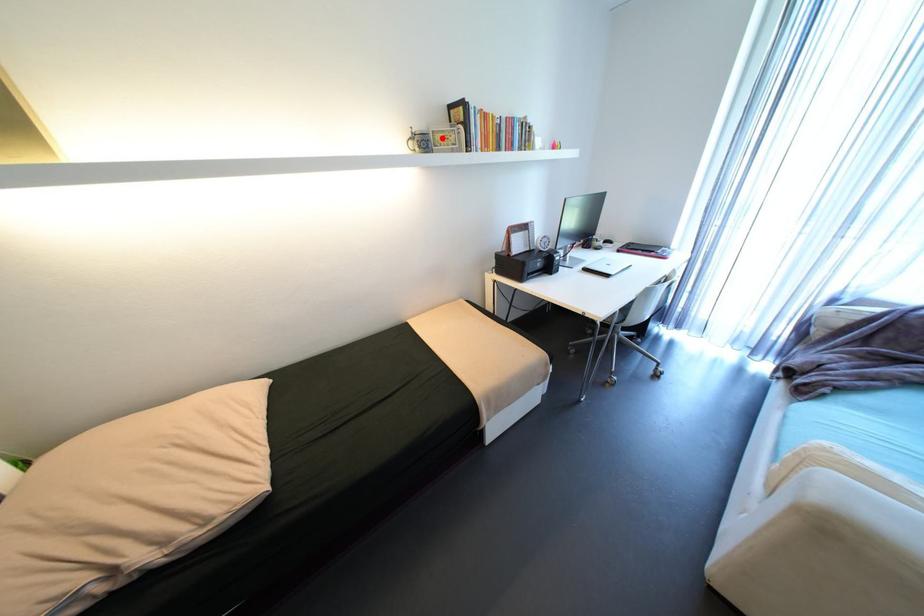
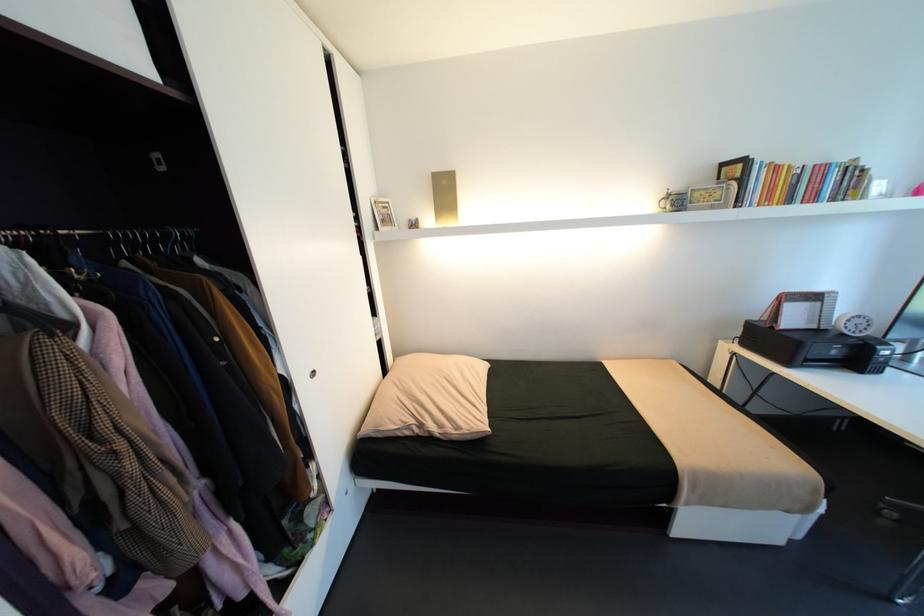
Where in the second image is the point corresponding to the highlighted location from the first image?

(700, 196)